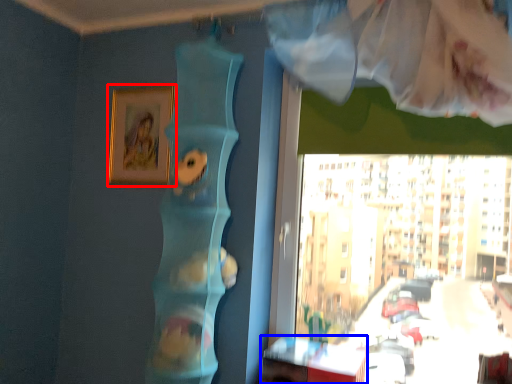
Question: Which object is further to the camera taking this photo, picture frame (highlighted by a red box) or table (highlighted by a blue box)?

Choices:
 (A) picture frame
 (B) table

Answer: (A)